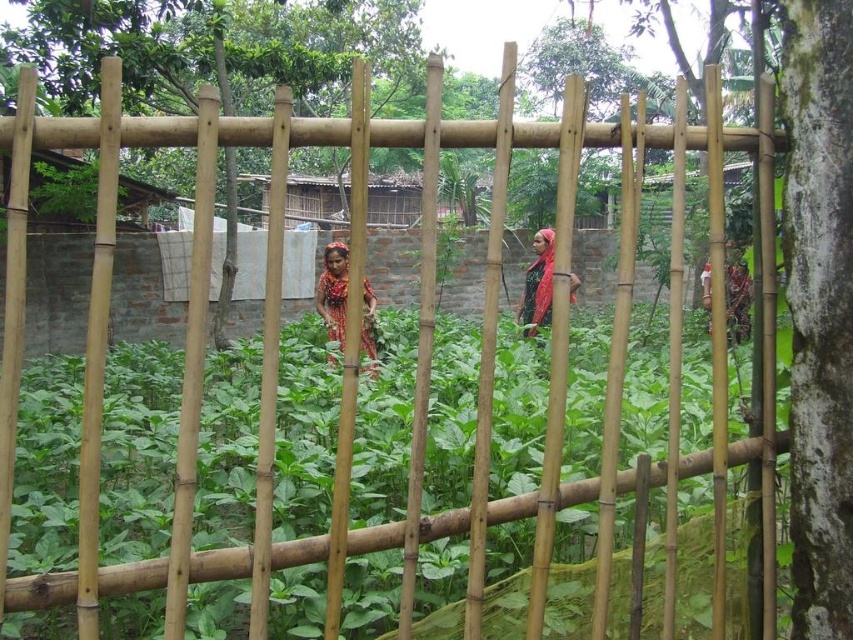
You are standing in front of the bamboo fence and see the red fabric headscarf at center and the matte green fabric at right. Which object is positioned higher in the scene?

The red fabric headscarf at center is much taller than the matte green fabric at right, so it is positioned higher in the scene.

You are standing in front of the bamboo fence looking at the rural scene. There are two points marked on the image at coordinates point (x=527, y=275) and point (x=746, y=278). Which point is nearer to you?

Point (x=527, y=275) is closer to the camera than point (x=746, y=278), so the point at (x=527, y=275) is nearer to you.